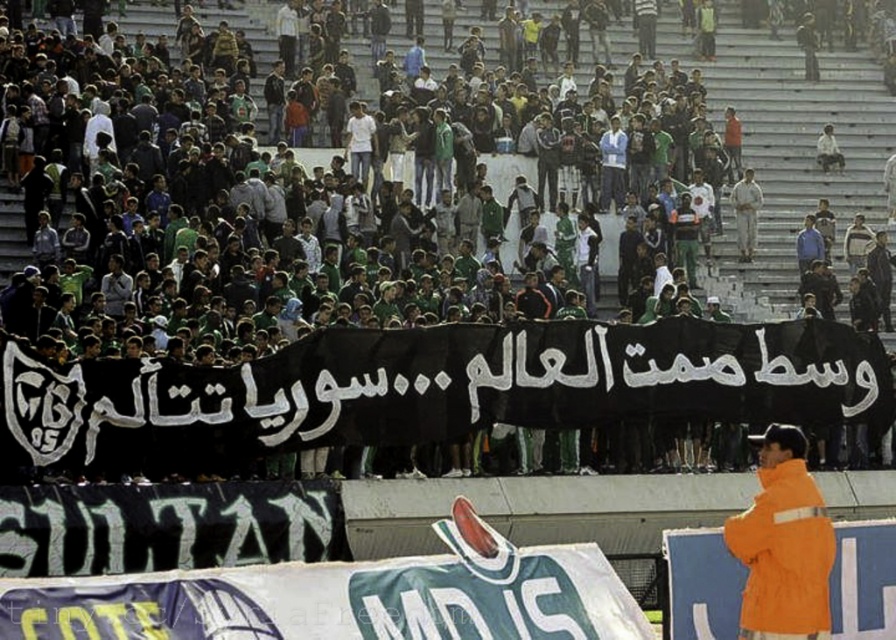
Is point (546, 36) closer to camera compared to point (807, 637)?

No, (546, 36) is further to viewer.

Is black fabric banner at center below orange matte jacket at lower right?

Actually, black fabric banner at center is above orange matte jacket at lower right.

This screenshot has height=640, width=896. I want to click on black fabric banner at center, so click(x=423, y=252).